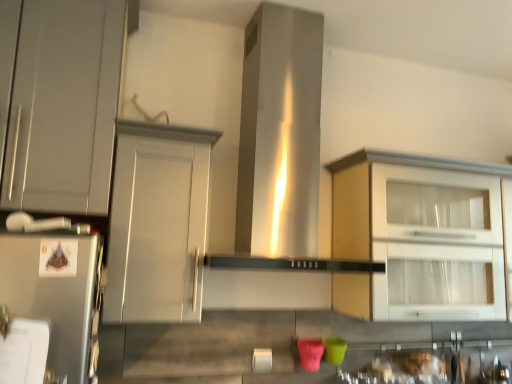
Question: From the image's perspective, is matte gray cabinet at left, which ranks as the 3th cabinetry in right-to-left order, located above or below matte gray cabinet at center, positioned as the 2th cabinetry in left-to-right order?

Choices:
 (A) below
 (B) above

Answer: (B)

Question: From a real-world perspective, is matte gray cabinet at left, the first cabinetry from the left, positioned above or below matte gray cabinet at center, positioned as the 2th cabinetry in left-to-right order?

Choices:
 (A) above
 (B) below

Answer: (A)

Question: Considering the real-world distances, which object is farthest from the matte gray cabinet at left, which ranks as the 3th cabinetry in right-to-left order?

Choices:
 (A) stainless steel vent at center
 (B) matte white cabinet at right, placed as the 3th cabinetry when sorted from left to right
 (C) matte gray cabinet at center, positioned as the 2th cabinetry in left-to-right order

Answer: (B)

Question: Based on their relative distances, which object is nearer to the matte gray cabinet at center, positioned as the 2th cabinetry in left-to-right order?

Choices:
 (A) matte gray cabinet at left, the first cabinetry from the left
 (B) stainless steel vent at center
 (C) matte white cabinet at right, which is the first cabinetry from right to left

Answer: (A)